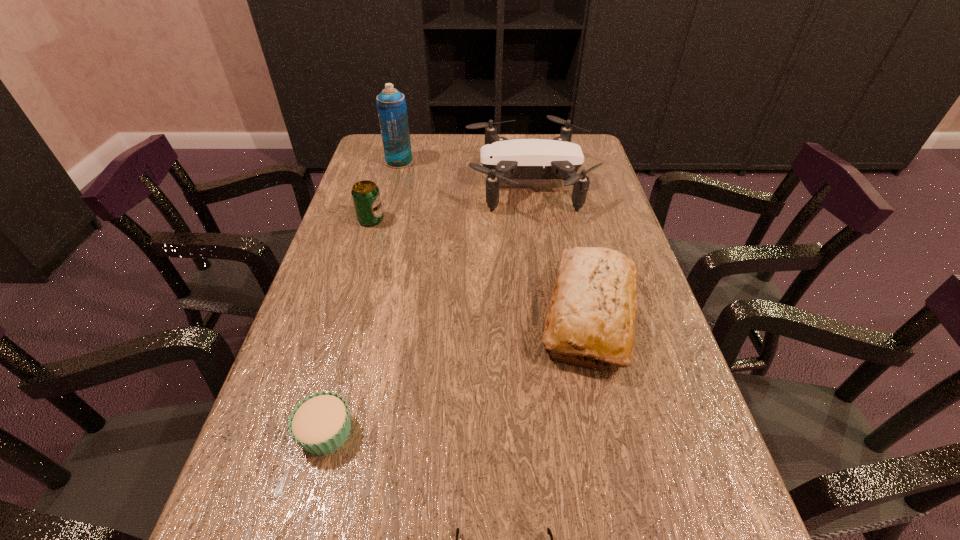
Identify the location of free space located on the left of the bread. (507, 315).

You are a GUI agent. You are given a task and a screenshot of the screen. Output one action in this format:
    pyautogui.click(x=<x>, y=<y>)
    Task: Click on the free space located on the right of the beer can
    This screenshot has height=540, width=960.
    Given the screenshot: What is the action you would take?
    pyautogui.click(x=468, y=220)

You are a GUI agent. You are given a task and a screenshot of the screen. Output one action in this format:
    pyautogui.click(x=<x>, y=<y>)
    Task: Click on the blank area located 0.190m on the right of the second shortest object
    The image size is (960, 540).
    Given the screenshot: What is the action you would take?
    pyautogui.click(x=464, y=432)

Identify the location of aerosol can that is at the far edge. The width and height of the screenshot is (960, 540). (391, 105).

Locate an element on the screen. drone at the far edge is located at coordinates (502, 159).

I want to click on aerosol can situated at the left edge, so click(391, 105).

This screenshot has height=540, width=960. Identify the location of beer can present at the left edge. (366, 197).

I want to click on cupcake positioned at the left edge, so click(x=320, y=424).

Where is `drone present at the right edge`? The width and height of the screenshot is (960, 540). drone present at the right edge is located at coordinates (502, 159).

Where is `bread present at the right edge`? This screenshot has height=540, width=960. bread present at the right edge is located at coordinates (593, 306).